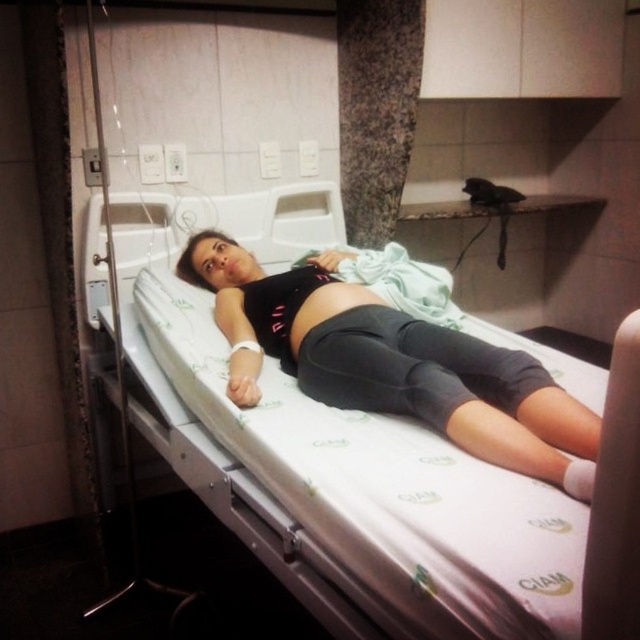
Question: In this image, where is white fabric hospital bed at center located relative to black matte leggings at center?

Choices:
 (A) below
 (B) above

Answer: (A)

Question: Does white fabric hospital bed at center have a lesser width compared to black matte leggings at center?

Choices:
 (A) no
 (B) yes

Answer: (A)

Question: Which object is farther from the camera taking this photo?

Choices:
 (A) white fabric hospital bed at center
 (B) black matte leggings at center

Answer: (B)

Question: Which of the following is the closest to the observer?

Choices:
 (A) (182, 257)
 (B) (403, 468)

Answer: (B)

Question: Does white fabric hospital bed at center appear over black matte leggings at center?

Choices:
 (A) no
 (B) yes

Answer: (A)

Question: Which point is closer to the camera?

Choices:
 (A) (598, 417)
 (B) (385, 618)

Answer: (B)